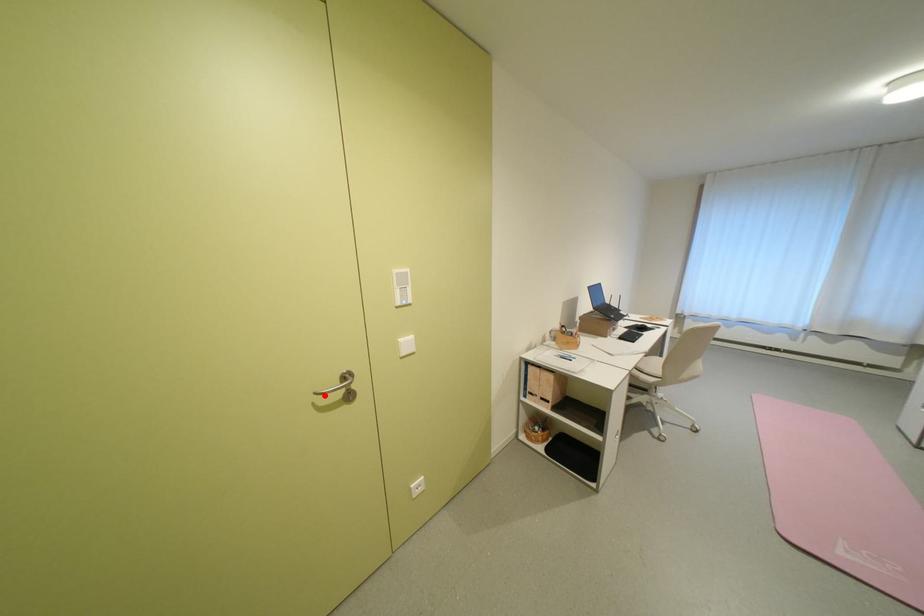
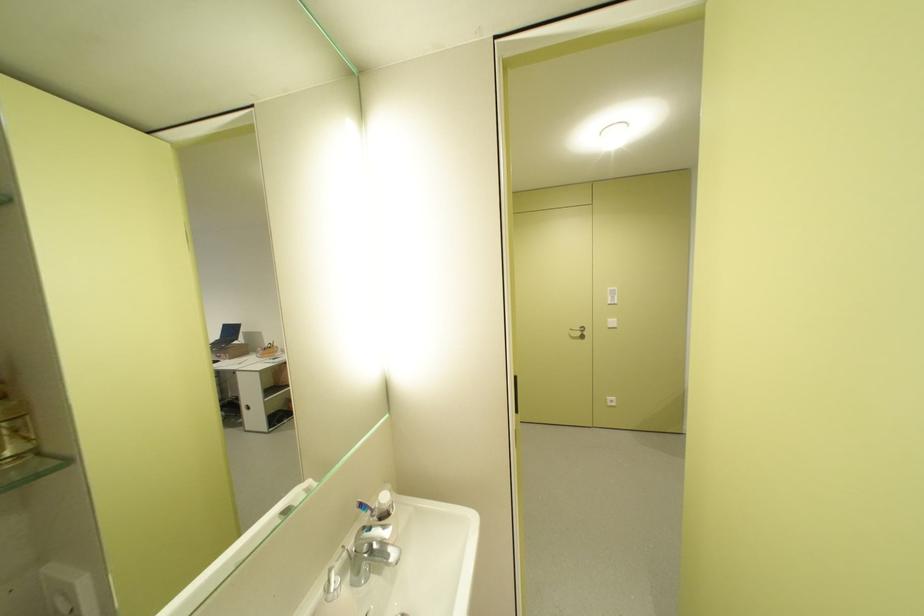
Find the pixel in the second image that matches the highlighted location in the first image.

(579, 331)